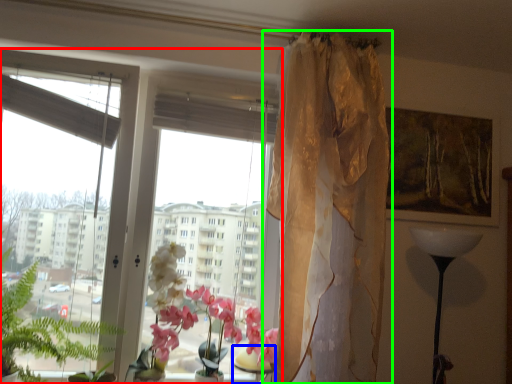
Question: Based on their relative distances, which object is farther from window (highlighted by a red box)? Choose from table (highlighted by a blue box) and curtain (highlighted by a green box).

Choices:
 (A) table
 (B) curtain

Answer: (B)